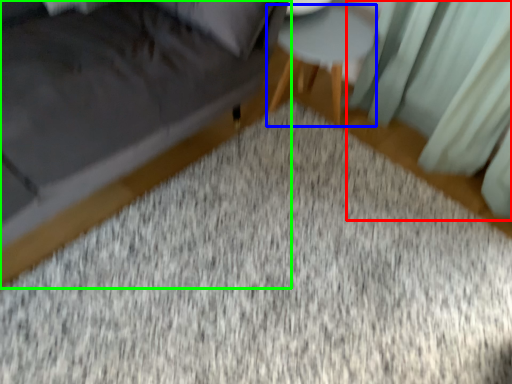
Question: Which object is the closest to the curtain (highlighted by a red box)? Choose among these: side table (highlighted by a blue box) or furniture (highlighted by a green box).

Choices:
 (A) side table
 (B) furniture

Answer: (A)